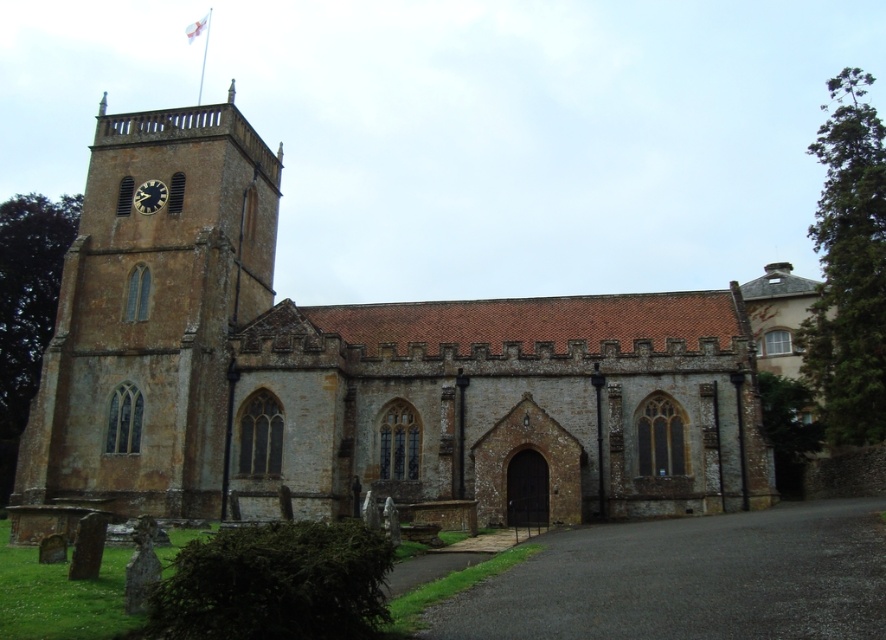
Question: Is brown stone tower at center-left thinner than matte black clock at upper left?

Choices:
 (A) no
 (B) yes

Answer: (A)

Question: Is brown stone church at center behind brown stone tower at center-left?

Choices:
 (A) yes
 (B) no

Answer: (A)

Question: Among these objects, which one is nearest to the camera?

Choices:
 (A) brown stone church at center
 (B) matte black clock at upper left
 (C) brown stone tower at center-left

Answer: (C)

Question: Where is brown stone church at center located in relation to matte black clock at upper left in the image?

Choices:
 (A) below
 (B) above

Answer: (A)

Question: Which object is closer to the camera taking this photo?

Choices:
 (A) matte black clock at upper left
 (B) brown stone church at center
 (C) brown stone tower at center-left

Answer: (C)

Question: Which point is closer to the camera?

Choices:
 (A) brown stone church at center
 (B) brown stone tower at center-left
 (C) matte black clock at upper left

Answer: (B)